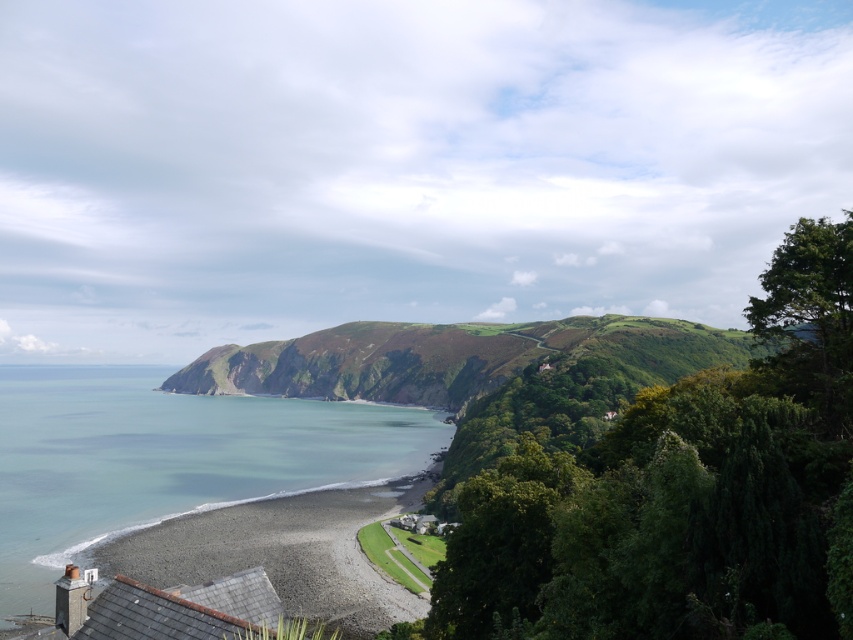
You are standing at the pebble beach on the left side of the coastal landscape and want to reach the winding road on the hillside. There are two points marked on your path. Which point, point (303,417) or point (355,557), is closer to you as you start your journey from the beach?

Point (303,417) is closer to you because it is further to the viewer than point (355,557), meaning it lies nearer along your path from the beach towards the hillside.

You are a hiker planning to cross from the gray gravel beach at lower left to the blue water at lower left. Considering their sizes, which one will you encounter first as you move towards the coast?

The gray gravel beach at lower left is smaller in size compared to the blue water at lower left. Since the gray gravel beach is smaller, you will reach the edge of it first before encountering the blue water at lower left.

You are standing on the gray gravel beach at lower left and want to walk to the blue water at lower left. Which direction should you move in?

You should move to the left, as the blue water at lower left is located to the left of the gray gravel beach at lower left.